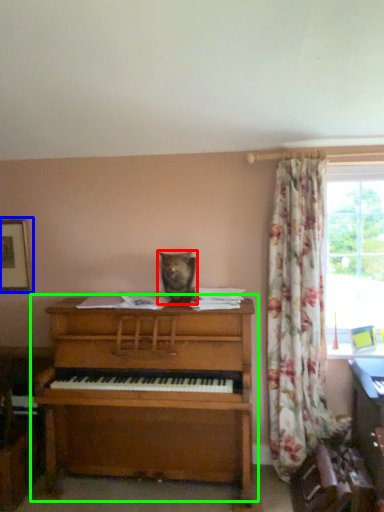
Question: Which object is positioned closest to animal (highlighted by a red box)? Select from picture frame (highlighted by a blue box) and piano (highlighted by a green box).

Choices:
 (A) picture frame
 (B) piano

Answer: (B)